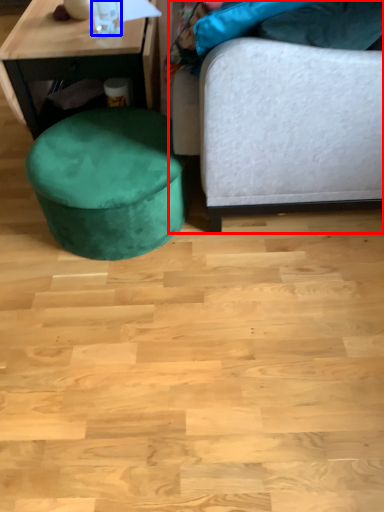
Question: Which of the following is the farthest to the observer, studio couch (highlighted by a red box) or bottle (highlighted by a blue box)?

Choices:
 (A) studio couch
 (B) bottle

Answer: (B)